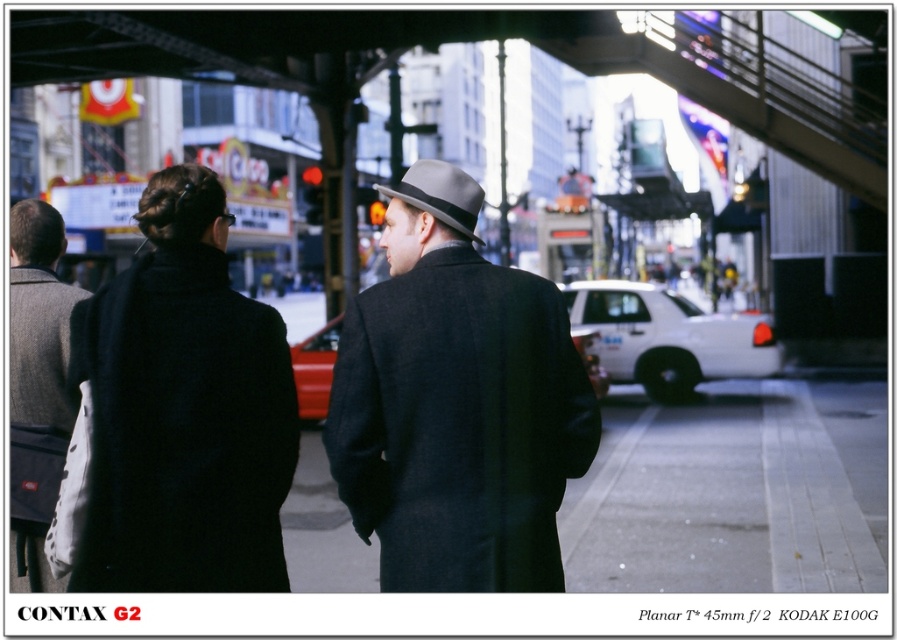
Question: Does black wool coat at left have a lesser width compared to gray wool coat at left?

Choices:
 (A) no
 (B) yes

Answer: (B)

Question: Is matte gray coat at center thinner than matte gray fedora at center?

Choices:
 (A) yes
 (B) no

Answer: (B)

Question: Among these points, which one is farthest from the camera?

Choices:
 (A) (31, 326)
 (B) (477, 241)
 (C) (475, 202)

Answer: (A)

Question: Can you confirm if gray wool coat at left is positioned to the right of matte gray fedora at center?

Choices:
 (A) yes
 (B) no

Answer: (B)

Question: Which object is the farthest from the matte gray coat at center?

Choices:
 (A) black wool coat at left
 (B) gray wool coat at left

Answer: (B)

Question: Which object is closer to the camera taking this photo?

Choices:
 (A) matte gray fedora at center
 (B) matte gray coat at center

Answer: (B)